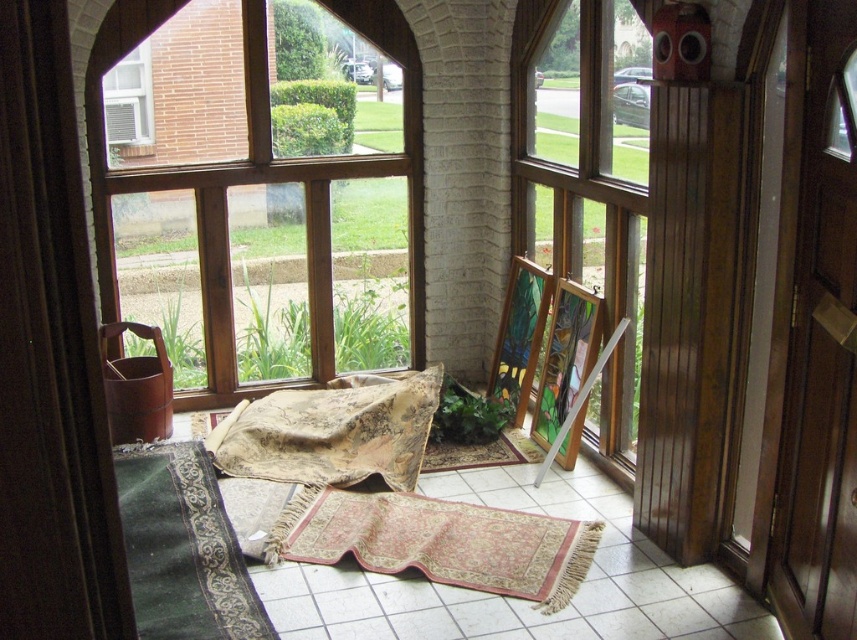
You have a rectangular item that you want to place on the rug with intricate patterns at center. The item is as wide as the woven fabric at center. Will it fit on the rug without overlapping the edges?

The woven fabric at center is wider than the rug with intricate patterns at center. Since the item is as wide as the woven fabric, it will be wider than the rug, so it won

You are a delivery person trying to place a package that is 20 inches long between the wooden frame at left and the white plastic air conditioner at upper left. Will there be enough space for the package to fit horizontally between them?

The wooden frame at left is 18.90 inches away from the white plastic air conditioner at upper left. Since the package is 20 inches long, which is longer than the available space, it will not fit horizontally between them.